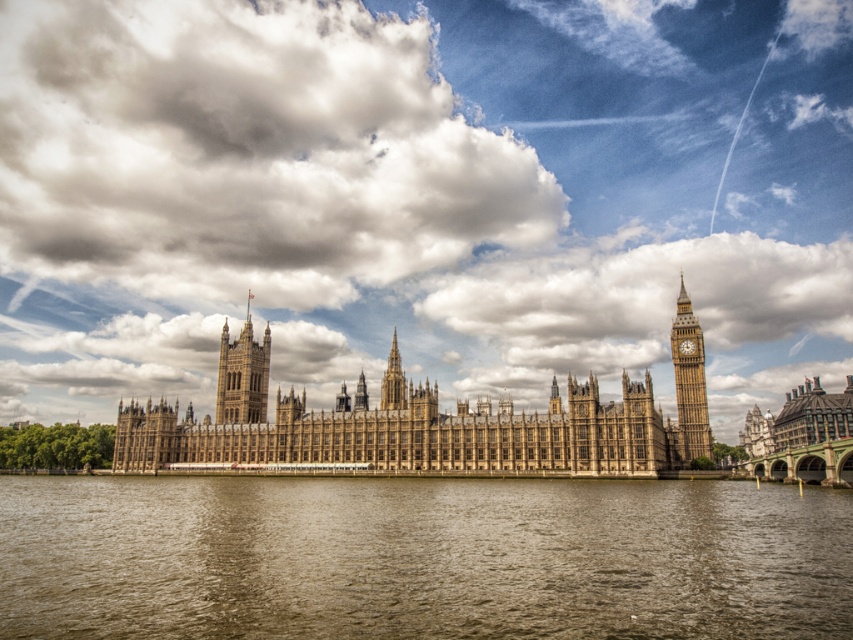
Is brown stone castle at center to the left of golden stone clock tower at right from the viewer's perspective?

Yes, brown stone castle at center is to the left of golden stone clock tower at right.

Is brown stone castle at center smaller than golden stone clock tower at right?

Actually, brown stone castle at center might be larger than golden stone clock tower at right.

Locate an element on the screen. Image resolution: width=853 pixels, height=640 pixels. brown stone castle at center is located at coordinates (425, 422).

Is brown stone castle at center further to the viewer compared to brown stone spire at center?

No, brown stone castle at center is in front of brown stone spire at center.

Who is more forward, (646, 433) or (396, 385)?

Positioned in front is point (646, 433).

Does point (238, 442) come farther from viewer compared to point (393, 344)?

No, (238, 442) is in front of (393, 344).

At what (x,y) coordinates should I click in order to perform the action: click on brown stone castle at center. Please return your answer as a coordinate pair (x, y). Image resolution: width=853 pixels, height=640 pixels. Looking at the image, I should click on (425, 422).

You are a GUI agent. You are given a task and a screenshot of the screen. Output one action in this format:
    pyautogui.click(x=<x>, y=<y>)
    Task: Click on the cloudy sky at upper center
    The width and height of the screenshot is (853, 640).
    Given the screenshot: What is the action you would take?
    pyautogui.click(x=247, y=152)

Is cloudy sky at upper center smaller than brown stone tower at center?

Actually, cloudy sky at upper center might be larger than brown stone tower at center.

The width and height of the screenshot is (853, 640). Identify the location of cloudy sky at upper center. (247, 152).